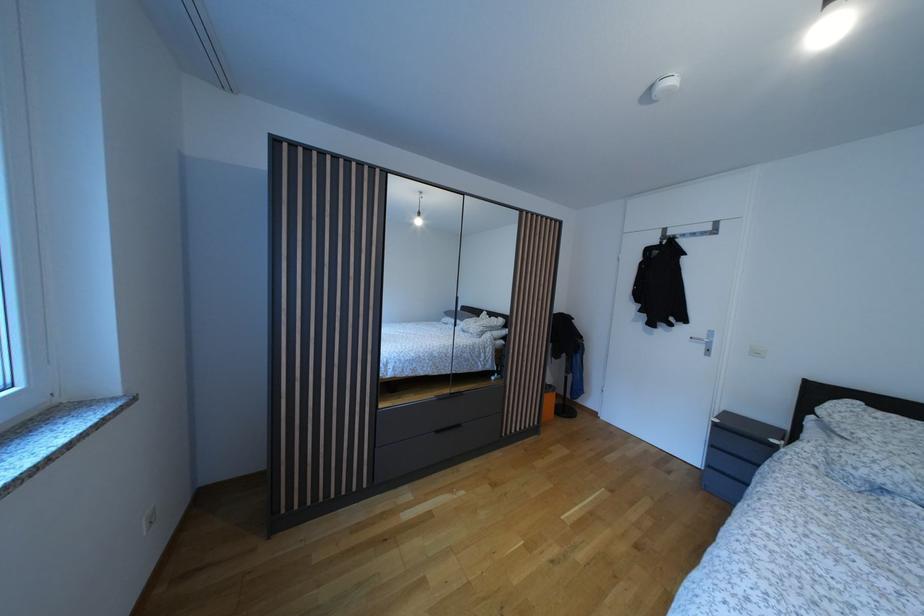
At what (x,y) coordinates should I click in order to perform the action: click on white light switch. Please return your answer as a coordinate pair (x, y). This screenshot has height=616, width=924. Looking at the image, I should click on (757, 351).